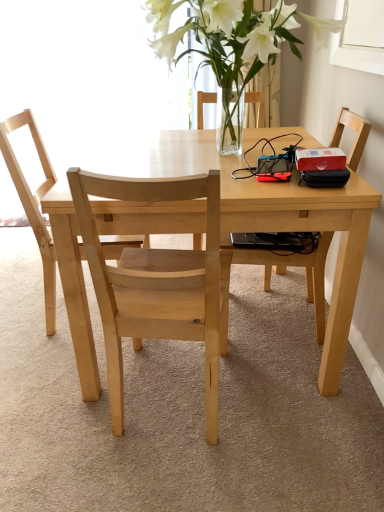
Locate an element on the screen. The width and height of the screenshot is (384, 512). free space to the left of natural wood chair at center, which appears as the 2th chair when viewed from the right is located at coordinates (49, 408).